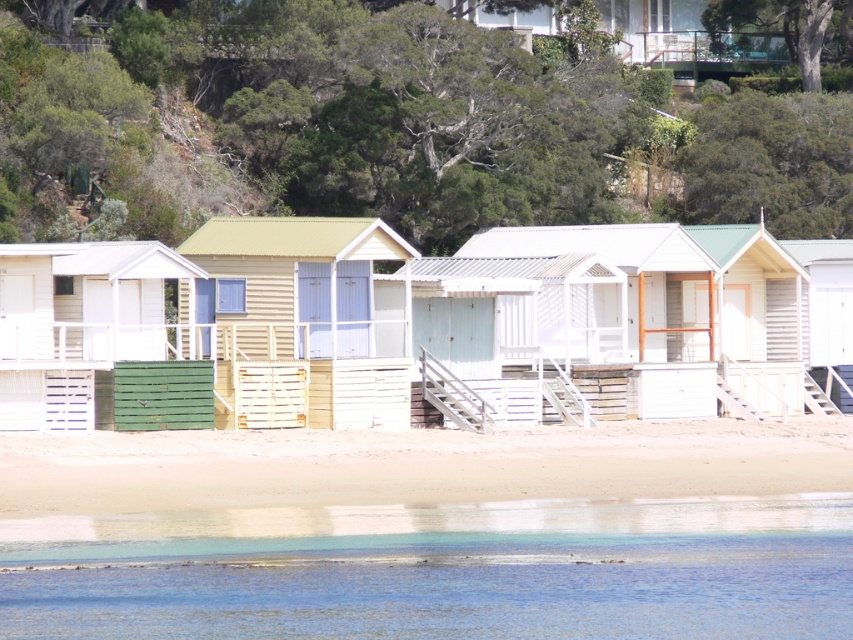
Locate an element on the screen. clear water at lower center is located at coordinates (439, 570).

Does clear water at lower center have a lesser width compared to matte green wood beach hut at left?

No.

Identify the location of clear water at lower center. (439, 570).

Is beige sand at lower center shorter than matte green wood beach hut at left?

Correct, beige sand at lower center is not as tall as matte green wood beach hut at left.

Who is shorter, beige sand at lower center or matte green wood beach hut at left?

With less height is beige sand at lower center.

Is point (706, 451) positioned behind point (28, 387)?

Yes, point (706, 451) is behind point (28, 387).

Locate an element on the screen. beige sand at lower center is located at coordinates (416, 465).

Who is shorter, clear water at lower center or beige sand at lower center?

clear water at lower center is shorter.

Can you confirm if clear water at lower center is positioned to the right of beige sand at lower center?

In fact, clear water at lower center is to the left of beige sand at lower center.

Locate an element on the screen. Image resolution: width=853 pixels, height=640 pixels. clear water at lower center is located at coordinates (439, 570).